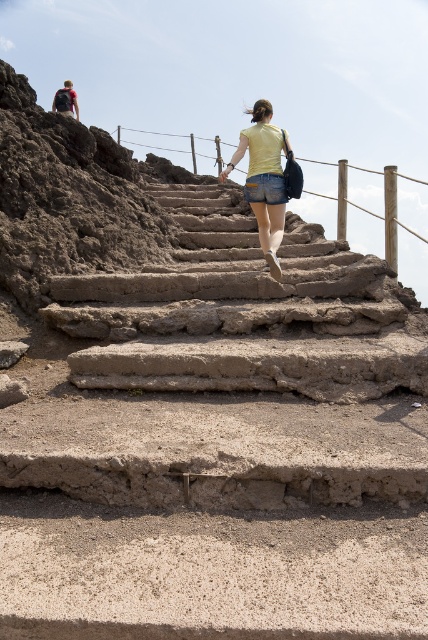
Does denim shorts at center have a greater width compared to red fabric backpack at upper left?

No, denim shorts at center is not wider than red fabric backpack at upper left.

You are a GUI agent. You are given a task and a screenshot of the screen. Output one action in this format:
    pyautogui.click(x=<x>, y=<y>)
    Task: Click on the denim shorts at center
    This screenshot has height=640, width=428.
    Given the screenshot: What is the action you would take?
    pyautogui.click(x=265, y=188)

The width and height of the screenshot is (428, 640). I want to click on denim shorts at center, so click(x=265, y=188).

Is rustic concrete stairs at center below red fabric backpack at upper left?

Yes.

This screenshot has height=640, width=428. I want to click on rustic concrete stairs at center, so click(241, 314).

Is brown dirt hill at upper left shorter than red fabric backpack at upper left?

Correct, brown dirt hill at upper left is not as tall as red fabric backpack at upper left.

Is brown dirt hill at upper left to the right of red fabric backpack at upper left from the viewer's perspective?

Correct, you'll find brown dirt hill at upper left to the right of red fabric backpack at upper left.

You are a GUI agent. You are given a task and a screenshot of the screen. Output one action in this format:
    pyautogui.click(x=<x>, y=<y>)
    Task: Click on the brown dirt hill at upper left
    The width and height of the screenshot is (428, 640).
    Given the screenshot: What is the action you would take?
    pyautogui.click(x=68, y=198)

The width and height of the screenshot is (428, 640). Find the location of `brown dirt hill at upper left`. brown dirt hill at upper left is located at coordinates pyautogui.click(x=68, y=198).